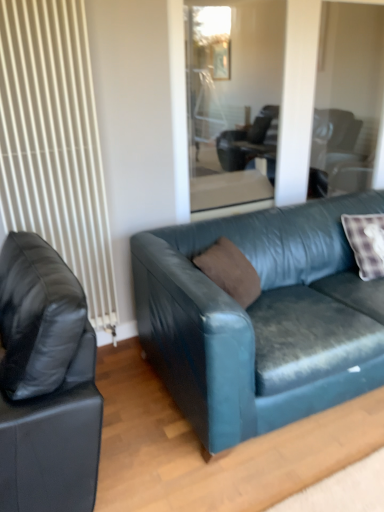
What is the approximate height of white ribbed radiator at left?

It is 5.90 feet.

In order to face transparent glass door at center, should I rotate leftwards or rightwards?

A 5.993 degree turn to the right will do.

Where is `brown suede pillow at center`? Image resolution: width=384 pixels, height=512 pixels. brown suede pillow at center is located at coordinates (230, 271).

What do you see at coordinates (261, 319) in the screenshot?
I see `teal leather couch at center, the 1th studio couch positioned from the right` at bounding box center [261, 319].

Find the location of a particular element. The width and height of the screenshot is (384, 512). white ribbed radiator at left is located at coordinates (55, 144).

Which object is positioned more to the right, transparent glass door at center or white ribbed radiator at left?

transparent glass door at center is more to the right.

This screenshot has height=512, width=384. I want to click on radiator that appears on the left of transparent glass door at center, so click(x=55, y=144).

Can you tell me how much transparent glass door at center and white ribbed radiator at left differ in facing direction?

There is a 0.245-degree angle between the facing directions of transparent glass door at center and white ribbed radiator at left.

From the image's perspective, is transparent glass door at center above white ribbed radiator at left?

Yes, from the image's perspective, transparent glass door at center is over white ribbed radiator at left.

Consider the image. Which of these two, white ribbed radiator at left or transparent glass door at center, stands shorter?

Standing shorter between the two is transparent glass door at center.

Considering the relative positions of white ribbed radiator at left and transparent glass door at center in the image provided, is white ribbed radiator at left behind transparent glass door at center?

No, white ribbed radiator at left is closer to the camera.

Is white ribbed radiator at left located outside transparent glass door at center?

white ribbed radiator at left lies outside transparent glass door at center's area.

What's the angular difference between white ribbed radiator at left and transparent glass door at center's facing directions?

white ribbed radiator at left and transparent glass door at center are facing 0.245 degrees away from each other.

Is transparent glass door at center positioned before brown suede pillow at center?

No.

Can you tell me how much transparent glass door at center and brown suede pillow at center differ in facing direction?

35.8 degrees.

Is transparent glass door at center far away from brown suede pillow at center?

transparent glass door at center is positioned a significant distance from brown suede pillow at center.

Is transparent glass door at center shorter than brown suede pillow at center?

In fact, transparent glass door at center may be taller than brown suede pillow at center.

Can teal leather couch at center, the 1th studio couch positioned from the right, be found inside white ribbed radiator at left?

No.

How many degrees apart are the facing directions of white ribbed radiator at left and teal leather couch at center, which ranks as the second studio couch in left-to-right order?

1.52 degrees separate the facing orientations of white ribbed radiator at left and teal leather couch at center, which ranks as the second studio couch in left-to-right order.

From a real-world perspective, is white ribbed radiator at left on teal leather couch at center, the 1th studio couch positioned from the right?

Correct, in the physical world, white ribbed radiator at left is higher than teal leather couch at center, the 1th studio couch positioned from the right.

Is the position of white ribbed radiator at left more distant than that of teal leather couch at center, which ranks as the second studio couch in left-to-right order?

Yes, white ribbed radiator at left is behind teal leather couch at center, which ranks as the second studio couch in left-to-right order.

Considering the relative sizes of white ribbed radiator at left and brown suede pillow at center in the image provided, is white ribbed radiator at left wider than brown suede pillow at center?

No.

From a real-world perspective, is white ribbed radiator at left physically located above or below brown suede pillow at center?

white ribbed radiator at left is situated higher than brown suede pillow at center in the real world.

Can you confirm if white ribbed radiator at left is positioned to the right of brown suede pillow at center?

Incorrect, white ribbed radiator at left is not on the right side of brown suede pillow at center.

From the image's perspective, which is above, white ribbed radiator at left or brown suede pillow at center?

white ribbed radiator at left appears higher in the image.

Locate an element on the screen. radiator on the left of the brown suede pillow at center is located at coordinates (55, 144).

Looking at this image, who is smaller, brown suede pillow at center or white ribbed radiator at left?

brown suede pillow at center.

Looking at this image, is brown suede pillow at center not near white ribbed radiator at left?

No, there isn't a large distance between brown suede pillow at center and white ribbed radiator at left.

Which of these two, brown suede pillow at center or white ribbed radiator at left, stands shorter?

brown suede pillow at center is shorter.

Can you see teal leather couch at center, the 1th studio couch positioned from the right, touching brown suede pillow at center?

No, teal leather couch at center, the 1th studio couch positioned from the right, is not making contact with brown suede pillow at center.

Considering the points (256, 251) and (212, 263), which point is in front, point (256, 251) or point (212, 263)?

The point (212, 263) is more forward.

How different are the orientations of teal leather couch at center, the 1th studio couch positioned from the right, and brown suede pillow at center in degrees?

There is a 37.1-degree angle between the facing directions of teal leather couch at center, the 1th studio couch positioned from the right, and brown suede pillow at center.

Can you confirm if teal leather couch at center, which ranks as the second studio couch in left-to-right order, is taller than brown suede pillow at center?

Yes, teal leather couch at center, which ranks as the second studio couch in left-to-right order, is taller than brown suede pillow at center.

At what (x,y) coordinates should I click in order to perform the action: click on radiator located on the left of transparent glass door at center. Please return your answer as a coordinate pair (x, y). This screenshot has height=512, width=384. Looking at the image, I should click on (55, 144).

Identify the location of glass door that is on the right side of white ribbed radiator at left. (232, 98).

Which object lies nearer to the anchor point brown suede pillow at center, teal leather couch at center, the 1th studio couch positioned from the right, or transparent glass door at center?

teal leather couch at center, the 1th studio couch positioned from the right.

From the image, which object appears to be nearer to teal leather couch at center, which ranks as the second studio couch in left-to-right order, matte black leather couch at left, which appears as the second studio couch when viewed from the right, or white ribbed radiator at left?

matte black leather couch at left, which appears as the second studio couch when viewed from the right, is positioned closer to the anchor teal leather couch at center, which ranks as the second studio couch in left-to-right order.

Considering their positions, is transparent glass door at center positioned further to white ribbed radiator at left than teal leather couch at center, which ranks as the second studio couch in left-to-right order?

transparent glass door at center is positioned further to the anchor white ribbed radiator at left.

Which object lies nearer to the anchor point transparent glass door at center, brown suede pillow at center or teal leather couch at center, the 1th studio couch positioned from the right?

Based on the image, teal leather couch at center, the 1th studio couch positioned from the right, appears to be nearer to transparent glass door at center.

Looking at the image, which one is located closer to brown suede pillow at center, white ribbed radiator at left or transparent glass door at center?

white ribbed radiator at left.

Based on their spatial positions, is white ribbed radiator at left or brown suede pillow at center further from transparent glass door at center?

brown suede pillow at center is further to transparent glass door at center.

Based on their spatial positions, is white ribbed radiator at left or transparent glass door at center further from matte black leather couch at left, which ranks as the first studio couch in left-to-right order?

transparent glass door at center is positioned further to the anchor matte black leather couch at left, which ranks as the first studio couch in left-to-right order.

Based on their spatial positions, is white ribbed radiator at left or matte black leather couch at left, which appears as the second studio couch when viewed from the right, closer to brown suede pillow at center?

Based on the image, matte black leather couch at left, which appears as the second studio couch when viewed from the right, appears to be nearer to brown suede pillow at center.

Where is `glass door located between white ribbed radiator at left and teal leather couch at center, the 1th studio couch positioned from the right, in the left-right direction`? glass door located between white ribbed radiator at left and teal leather couch at center, the 1th studio couch positioned from the right, in the left-right direction is located at coordinates (232, 98).

The image size is (384, 512). Find the location of `glass door located between matte black leather couch at left, which ranks as the first studio couch in left-to-right order, and teal leather couch at center, which ranks as the second studio couch in left-to-right order, in the left-right direction`. glass door located between matte black leather couch at left, which ranks as the first studio couch in left-to-right order, and teal leather couch at center, which ranks as the second studio couch in left-to-right order, in the left-right direction is located at coordinates (232, 98).

Find the location of a particular element. The width and height of the screenshot is (384, 512). studio couch between white ribbed radiator at left and brown suede pillow at center in the horizontal direction is located at coordinates (46, 383).

The width and height of the screenshot is (384, 512). Find the location of `pillow between white ribbed radiator at left and teal leather couch at center, which ranks as the second studio couch in left-to-right order, in the horizontal direction`. pillow between white ribbed radiator at left and teal leather couch at center, which ranks as the second studio couch in left-to-right order, in the horizontal direction is located at coordinates (230, 271).